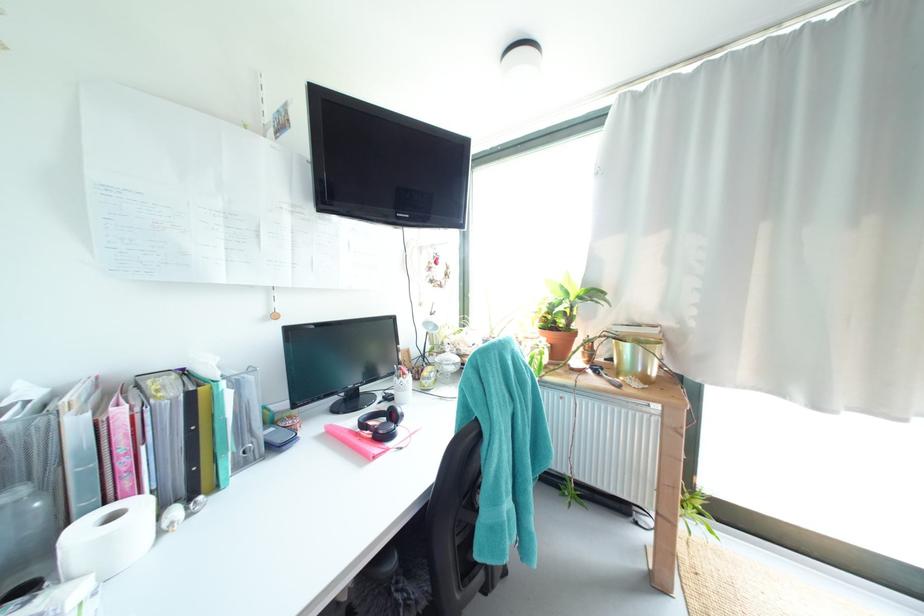
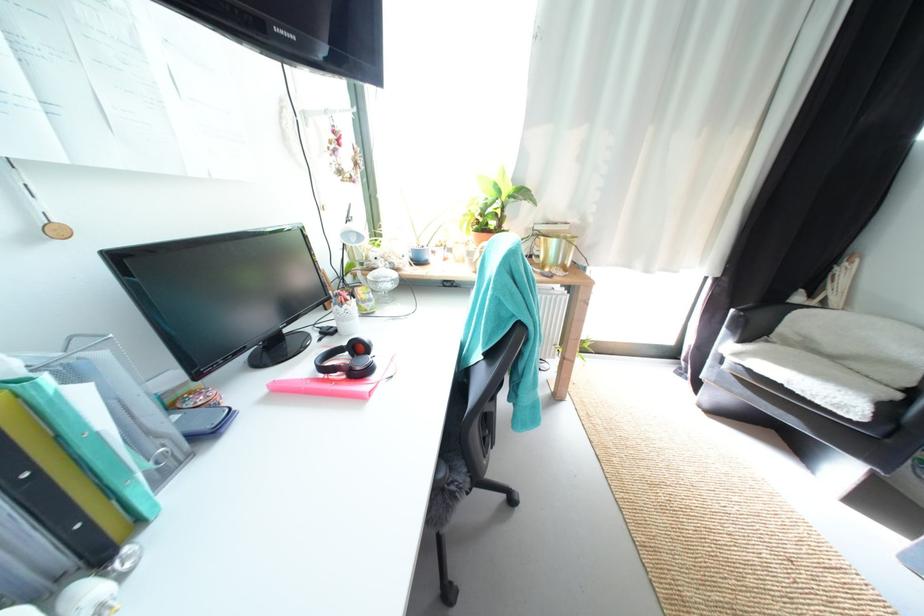
First-person continuous shooting, in which direction is the camera rotating?

The camera's rotation is toward right-down.